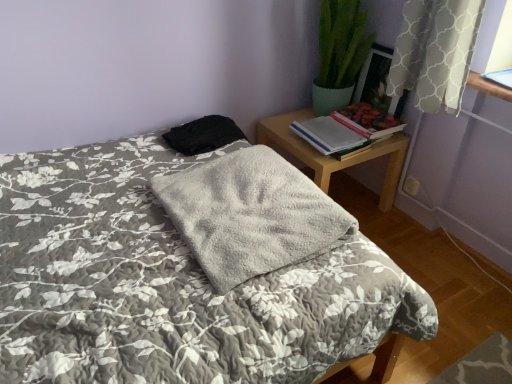
Question: Is the position of wooden nightstand at upper right less distant than that of black fabric at upper center?

Choices:
 (A) no
 (B) yes

Answer: (A)

Question: Can you confirm if wooden nightstand at upper right is bigger than black fabric at upper center?

Choices:
 (A) yes
 (B) no

Answer: (A)

Question: Is wooden nightstand at upper right smaller than black fabric at upper center?

Choices:
 (A) no
 (B) yes

Answer: (A)

Question: Can you confirm if wooden nightstand at upper right is positioned to the right of black fabric at upper center?

Choices:
 (A) no
 (B) yes

Answer: (B)

Question: Is wooden nightstand at upper right positioned beyond the bounds of black fabric at upper center?

Choices:
 (A) yes
 (B) no

Answer: (A)

Question: Visually, is gray fluffy blanket at center positioned to the left or to the right of wooden nightstand at upper right?

Choices:
 (A) right
 (B) left

Answer: (B)

Question: Is gray fluffy blanket at center taller or shorter than wooden nightstand at upper right?

Choices:
 (A) short
 (B) tall

Answer: (A)

Question: In terms of width, does gray fluffy blanket at center look wider or thinner when compared to wooden nightstand at upper right?

Choices:
 (A) wide
 (B) thin

Answer: (B)

Question: From the image's perspective, relative to wooden nightstand at upper right, is gray fluffy blanket at center above or below?

Choices:
 (A) above
 (B) below

Answer: (B)

Question: Based on their sizes in the image, would you say black fabric at upper center is bigger or smaller than wooden nightstand at upper right?

Choices:
 (A) big
 (B) small

Answer: (B)

Question: Would you say black fabric at upper center is inside or outside wooden nightstand at upper right?

Choices:
 (A) inside
 (B) outside

Answer: (B)

Question: Based on their positions, is black fabric at upper center located to the left or right of wooden nightstand at upper right?

Choices:
 (A) left
 (B) right

Answer: (A)

Question: In the image, is black fabric at upper center positioned in front of or behind wooden nightstand at upper right?

Choices:
 (A) front
 (B) behind

Answer: (A)

Question: Considering their positions, is white paper book at right, the 2th book from the right, located in front of or behind black fabric at upper center?

Choices:
 (A) front
 (B) behind

Answer: (B)

Question: Is white paper book at right, the first book positioned from the left, inside the boundaries of black fabric at upper center, or outside?

Choices:
 (A) outside
 (B) inside

Answer: (A)